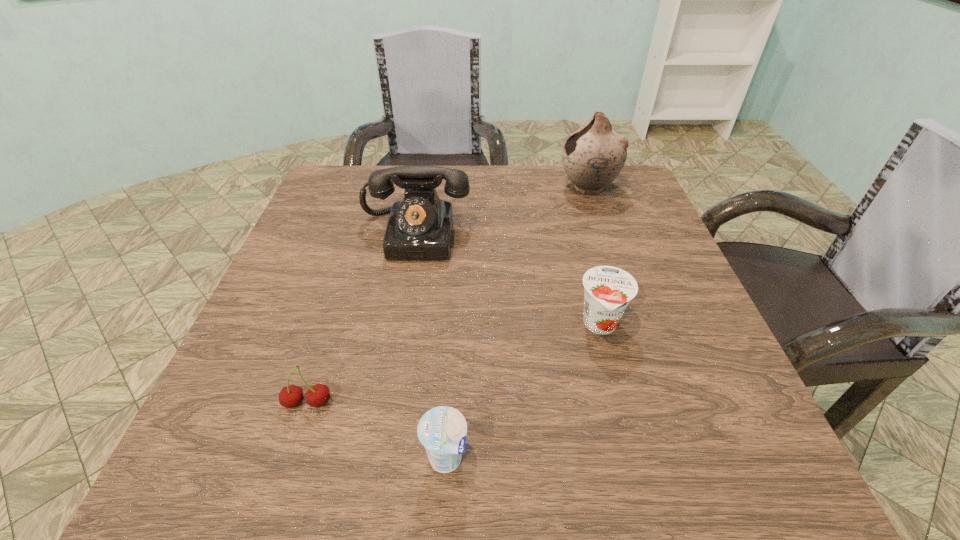
Identify the location of the farthest object. (593, 156).

I want to click on pottery, so click(593, 156).

The height and width of the screenshot is (540, 960). What are the coordinates of `the second tallest object` in the screenshot? It's located at (419, 227).

Image resolution: width=960 pixels, height=540 pixels. What are the coordinates of `the fourth nearest object` in the screenshot? It's located at (419, 227).

You are a GUI agent. You are given a task and a screenshot of the screen. Output one action in this format:
    pyautogui.click(x=<x>, y=<y>)
    Task: Click on the farther yogurt
    The width and height of the screenshot is (960, 540).
    Given the screenshot: What is the action you would take?
    pyautogui.click(x=608, y=290)

At what (x,y) coordinates should I click in order to perform the action: click on the right yogurt. Please return your answer as a coordinate pair (x, y). Looking at the image, I should click on (608, 290).

Where is `the fourth farthest object`? The image size is (960, 540). the fourth farthest object is located at coordinates (291, 396).

In order to click on the shorter yogurt in this screenshot , I will do `click(442, 430)`.

In order to click on the nearest object in this screenshot , I will do `click(442, 430)`.

Where is `vacant space situated from the spout of the pottery`? This screenshot has height=540, width=960. vacant space situated from the spout of the pottery is located at coordinates (498, 188).